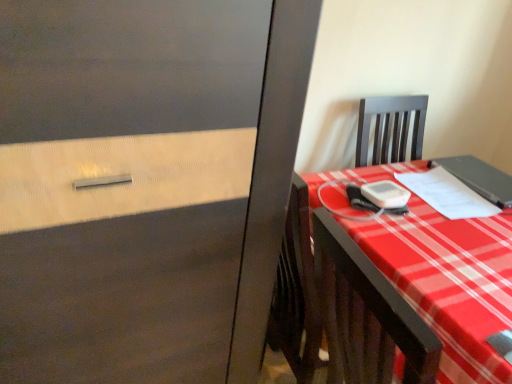
Question: From the image's perspective, is matte black notebook at right, which is counted as the first notebook, starting from the right, above or below white paper at right, marked as the second notebook in a right-to-left arrangement?

Choices:
 (A) above
 (B) below

Answer: (A)

Question: Is matte black notebook at right, which is counted as the first notebook, starting from the right, taller or shorter than white paper at right, marked as the second notebook in a right-to-left arrangement?

Choices:
 (A) short
 (B) tall

Answer: (B)

Question: Based on their relative distances, which object is nearer to the matte black notebook at right, which is counted as the first notebook, starting from the right?

Choices:
 (A) white paper at right, marked as the second notebook in a right-to-left arrangement
 (B) plaid fabric desk at right

Answer: (A)

Question: Which object is positioned farthest from the plaid fabric desk at right?

Choices:
 (A) matte black notebook at right, which ranks as the 2th notebook in left-to-right order
 (B) white paper at right, arranged as the 1th notebook when viewed from the left

Answer: (A)